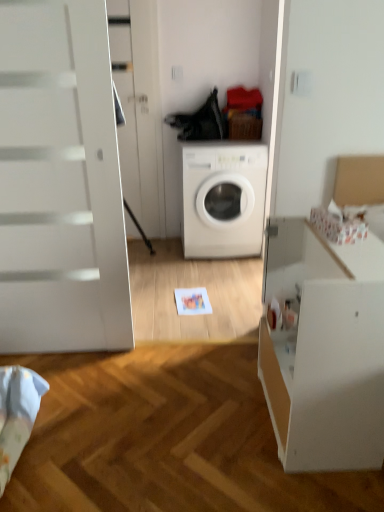
Question: From a real-world perspective, relative to white glossy screen door at upper left, is white matte washing machine at center vertically above or below?

Choices:
 (A) below
 (B) above

Answer: (A)

Question: Is white matte washing machine at center in front of or behind white glossy screen door at upper left in the image?

Choices:
 (A) behind
 (B) front

Answer: (A)

Question: Considering the real-world distances, which object is farthest from the white matte washing machine at center?

Choices:
 (A) white glossy screen door at upper left
 (B) white matte file cabinet at right

Answer: (B)

Question: Which is nearer to the white matte washing machine at center?

Choices:
 (A) white glossy screen door at upper left
 (B) white matte file cabinet at right

Answer: (A)